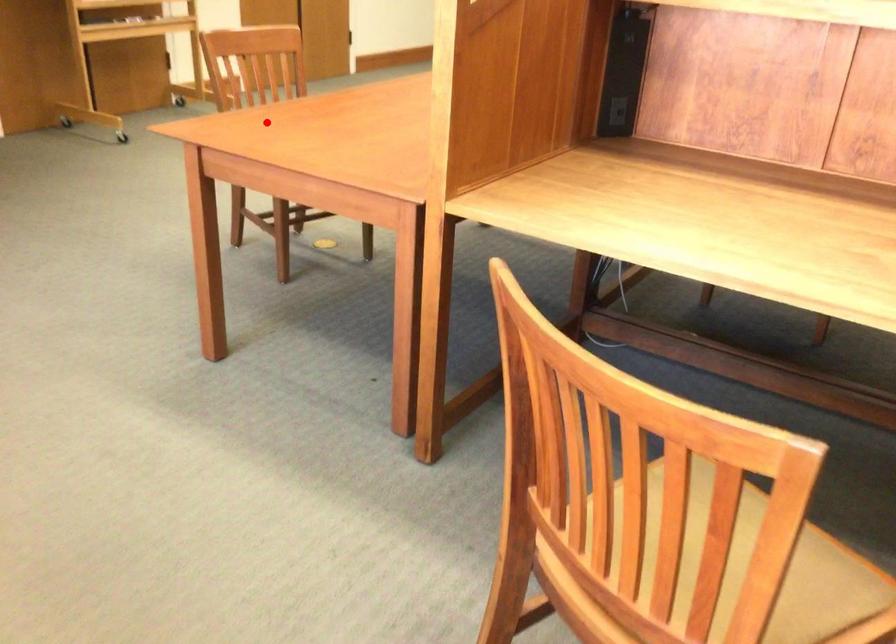
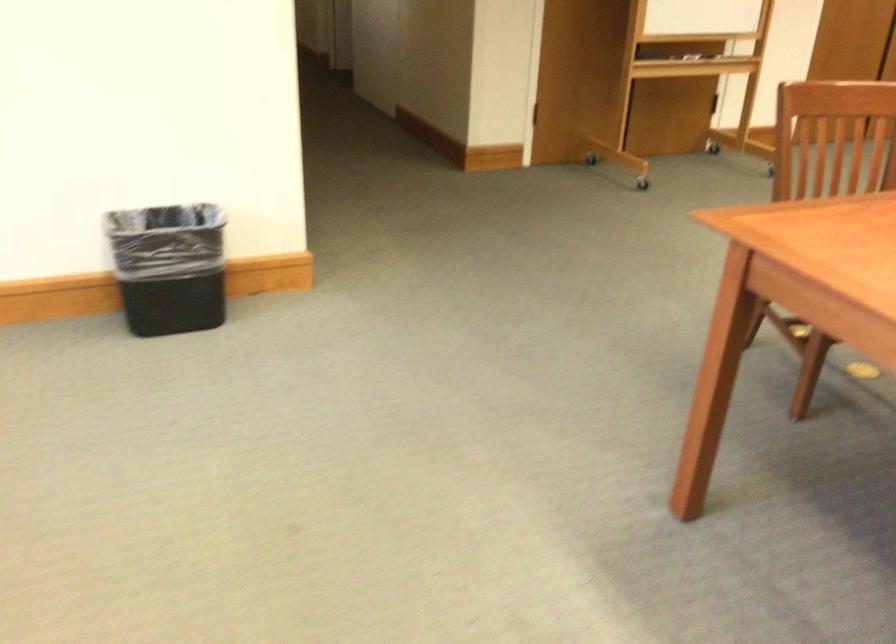
Question: I am providing you with two images of the same scene from different viewpoints. Image1 has a red point marked. In image2, the corresponding 3D location appears at what relative position? Reply with the corresponding letter.

Choices:
 (A) Closer
 (B) Farther

Answer: (A)